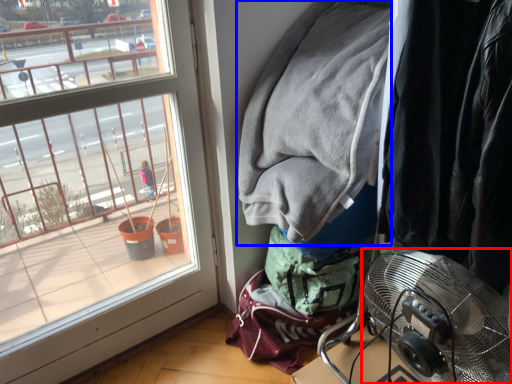
Question: Which point is further to the camera, mechanical fan (highlighted by a red box) or jacket (highlighted by a blue box)?

Choices:
 (A) mechanical fan
 (B) jacket

Answer: (B)